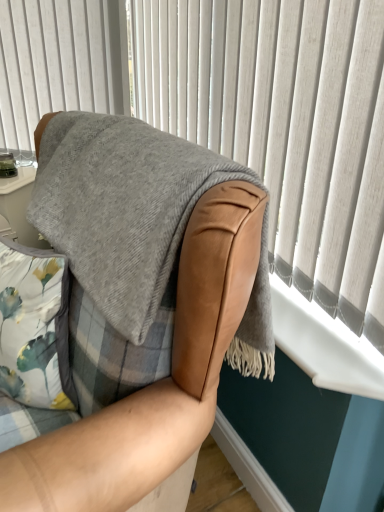
Question: Should I look upward or downward to see white plastic window sill at lower right?

Choices:
 (A) down
 (B) up

Answer: (A)

Question: Is gray woolen blanket at upper right not inside leather armchair at center?

Choices:
 (A) no
 (B) yes

Answer: (B)

Question: From a real-world perspective, is gray woolen blanket at upper right over leather armchair at center?

Choices:
 (A) no
 (B) yes

Answer: (B)

Question: Does gray woolen blanket at upper right come in front of leather armchair at center?

Choices:
 (A) no
 (B) yes

Answer: (A)

Question: Considering the relative sizes of gray woolen blanket at upper right and leather armchair at center in the image provided, is gray woolen blanket at upper right shorter than leather armchair at center?

Choices:
 (A) yes
 (B) no

Answer: (A)

Question: Does gray woolen blanket at upper right appear on the left side of leather armchair at center?

Choices:
 (A) no
 (B) yes

Answer: (A)

Question: Is gray woolen blanket at upper right thinner than leather armchair at center?

Choices:
 (A) no
 (B) yes

Answer: (B)

Question: Considering the relative sizes of leather armchair at center and gray woolen blanket at upper right in the image provided, is leather armchair at center smaller than gray woolen blanket at upper right?

Choices:
 (A) no
 (B) yes

Answer: (A)

Question: Can you confirm if leather armchair at center is shorter than gray woolen blanket at upper right?

Choices:
 (A) no
 (B) yes

Answer: (A)

Question: Can you confirm if leather armchair at center is bigger than gray woolen blanket at upper right?

Choices:
 (A) no
 (B) yes

Answer: (B)

Question: Is leather armchair at center at the left side of gray woolen blanket at upper right?

Choices:
 (A) no
 (B) yes

Answer: (B)

Question: From a real-world perspective, is leather armchair at center beneath gray woolen blanket at upper right?

Choices:
 (A) no
 (B) yes

Answer: (B)

Question: Does leather armchair at center have a lesser width compared to gray woolen blanket at upper right?

Choices:
 (A) yes
 (B) no

Answer: (B)

Question: Does white plastic window sill at lower right have a larger size compared to leather armchair at center?

Choices:
 (A) no
 (B) yes

Answer: (A)